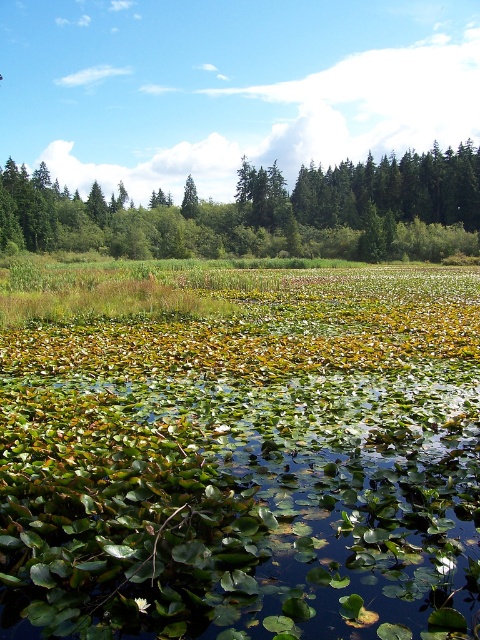
You are standing at the edge of the water in the scene and want to reach both the point labeled as point (463, 202) and the point labeled as point (187, 216). Which point will you reach first while moving towards them?

You will reach point (463, 202) first because it is closer to you than point (187, 216).

You are standing at the edge of the water and want to take a photo of the green leafy water at center and the green matte tree at center. Which object will appear closer to you in the photo?

The green leafy water at center will appear closer to you in the photo because it is positioned in front of the green matte tree at center.